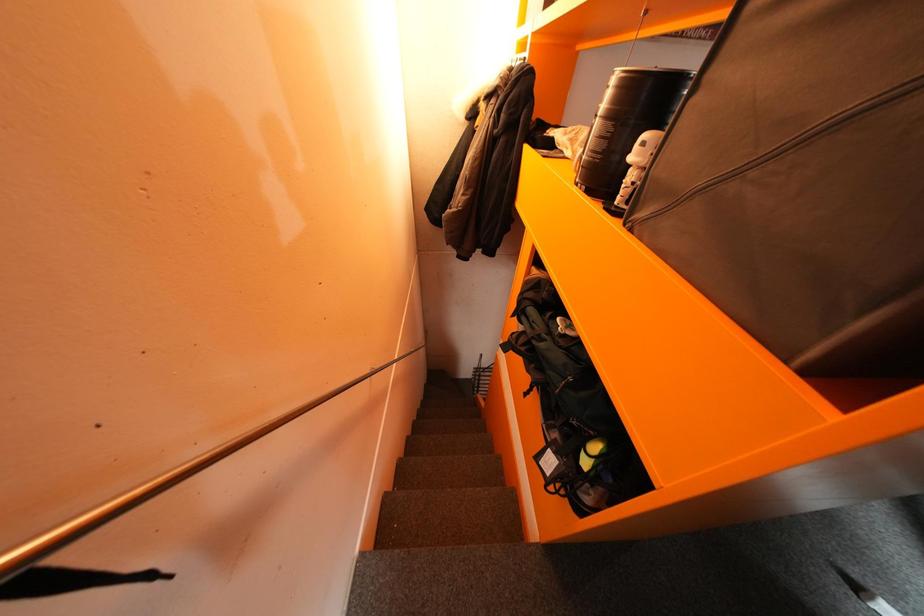
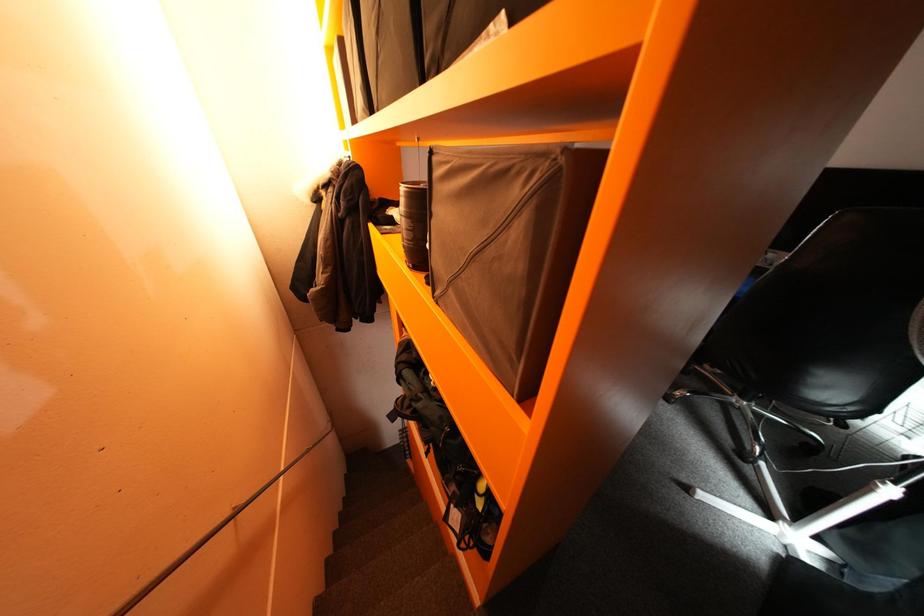
Question: The camera is either moving clockwise (left) or counter-clockwise (right) around the object. The first image is from the beginning of the video and the second image is from the end. Is the camera moving left or right when shooting the video?

Choices:
 (A) Left
 (B) Right

Answer: (A)